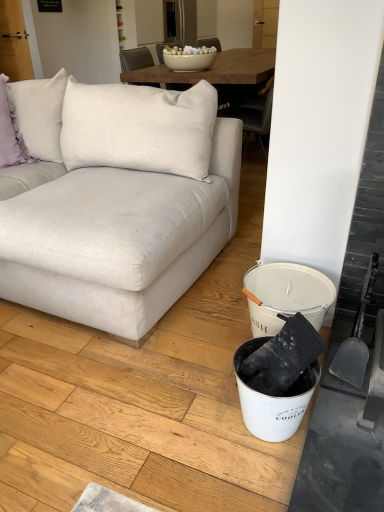
Identify the location of free point to the left of white matte bucket at lower right. The width and height of the screenshot is (384, 512). (199, 423).